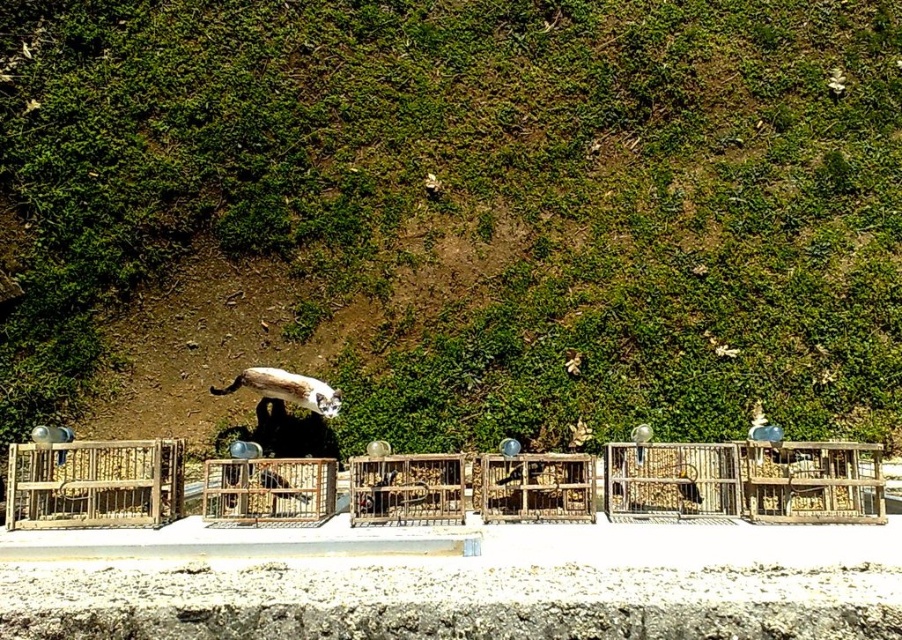
You are standing on the balcony and want to place a new birdcage exactly where the wooden birdcages at center are currently located. According to the coordinates provided, where should you position the new birdcage?

You should position the new birdcage at the coordinates point [747,481] where the wooden birdcages at center are located.

You are a bird breeder who wants to place a new birdcage in the row of wooden birdcages at center and wooden birdcage at center. Which existing birdcage should you match the width of to ensure compatibility?

The wooden birdcages at center are wider than the wooden birdcage at center, so you should match the width of the wooden birdcage at center to ensure compatibility.

Looking at this image, you are standing on the balcony and want to place a new birdcage exactly where the wooden birdcage at left is currently located. According to the coordinates provided, where should you position the new birdcage?

You should position the new birdcage at coordinates point (94, 483) where the wooden birdcage at left is currently located.